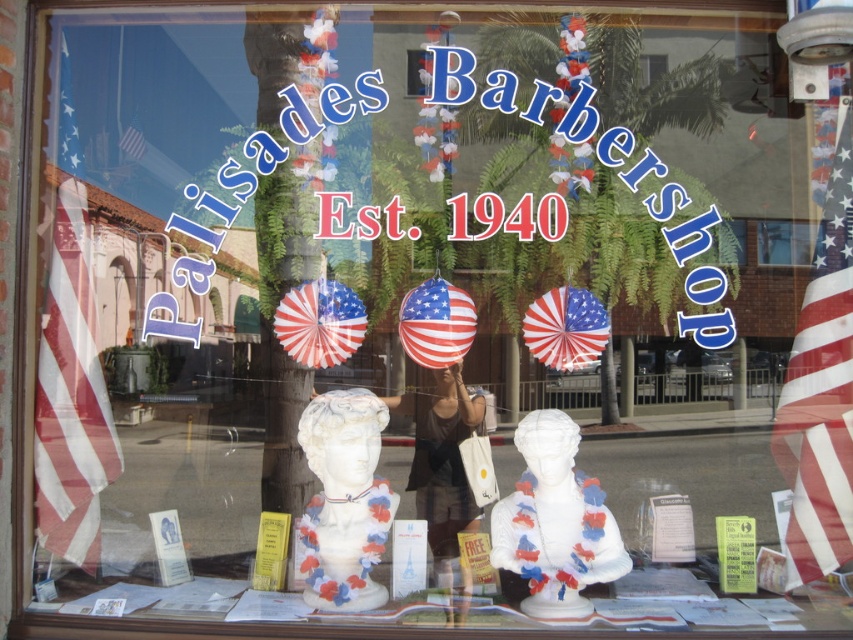
Is american flag at right above matte brown shirt at center?

Yes, american flag at right is above matte brown shirt at center.

The width and height of the screenshot is (853, 640). Find the location of `american flag at right`. american flag at right is located at coordinates (821, 390).

Which is in front, point (788, 529) or point (408, 401)?

Point (788, 529)

The height and width of the screenshot is (640, 853). I want to click on american flag at right, so click(821, 390).

Is point (70, 465) positioned in front of point (321, 481)?

No, it is behind (321, 481).

Between red-white-striped fabric flag at left and white marble bust at center, which one has more height?

Standing taller between the two is red-white-striped fabric flag at left.

Looking at this image, who is more distant from viewer, (90, 352) or (363, 561)?

The point (90, 352) is more distant.

Locate an element on the screen. red-white-striped fabric flag at left is located at coordinates (71, 396).

Find the location of a particular element. This screenshot has width=853, height=640. american flag at right is located at coordinates (821, 390).

Can you confirm if american flag at right is taller than white glossy bust at center?

Indeed, american flag at right has a greater height compared to white glossy bust at center.

At what (x,y) coordinates should I click in order to perform the action: click on american flag at right. Please return your answer as a coordinate pair (x, y). This screenshot has height=640, width=853. Looking at the image, I should click on (821, 390).